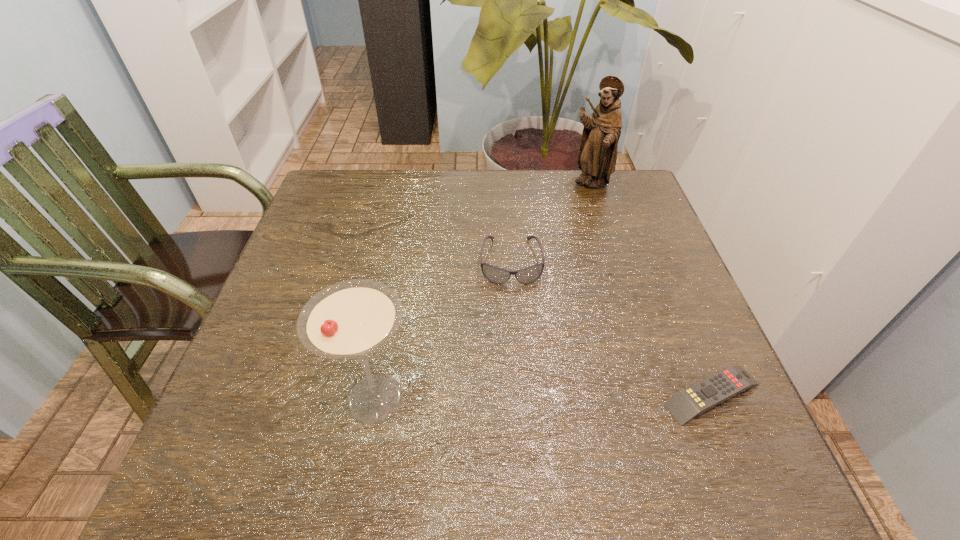
Image resolution: width=960 pixels, height=540 pixels. In order to click on empty space that is in between the tallest object and the leftmost object in this screenshot , I will do `click(483, 291)`.

You are a GUI agent. You are given a task and a screenshot of the screen. Output one action in this format:
    pyautogui.click(x=<x>, y=<y>)
    Task: Click on the vacant space that is in between the shortest object and the leftmost object
    The height and width of the screenshot is (540, 960).
    Given the screenshot: What is the action you would take?
    pyautogui.click(x=544, y=396)

The height and width of the screenshot is (540, 960). I want to click on unoccupied position between the figurine and the leftmost object, so (483, 291).

Where is `vacant space that's between the leftmost object and the third object from right to left`? vacant space that's between the leftmost object and the third object from right to left is located at coordinates (444, 330).

Where is `unoccupied area between the martini and the second shortest object`? Image resolution: width=960 pixels, height=540 pixels. unoccupied area between the martini and the second shortest object is located at coordinates (444, 330).

You are a GUI agent. You are given a task and a screenshot of the screen. Output one action in this format:
    pyautogui.click(x=<x>, y=<y>)
    Task: Click on the vacant area between the figurine and the martini
    
    Given the screenshot: What is the action you would take?
    pyautogui.click(x=483, y=291)

Where is `unoccupied area between the figurine and the third shortest object`? This screenshot has width=960, height=540. unoccupied area between the figurine and the third shortest object is located at coordinates pos(483,291).

This screenshot has height=540, width=960. Find the location of `blank region between the remote control and the leftmost object`. blank region between the remote control and the leftmost object is located at coordinates (544, 396).

The image size is (960, 540). I want to click on empty location between the second shortest object and the shortest object, so click(x=612, y=328).

Point out which object is positioned as the third nearest to the leftmost object. Please provide its 2D coordinates. Your answer should be formatted as a tuple, i.e. [(x, y)], where the tuple contains the x and y coordinates of a point satisfying the conditions above.

[(597, 156)]